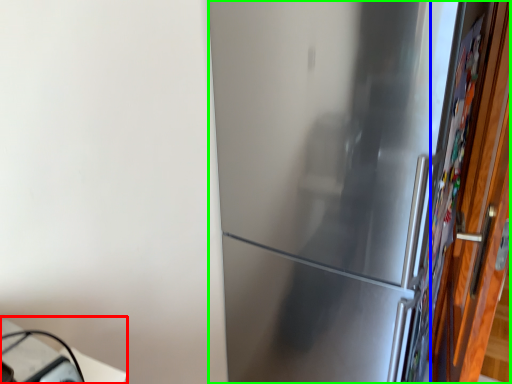
Question: Which is nearer to the table (highlighted by a red box)? door (highlighted by a blue box) or refrigerator (highlighted by a green box).

Choices:
 (A) door
 (B) refrigerator

Answer: (B)